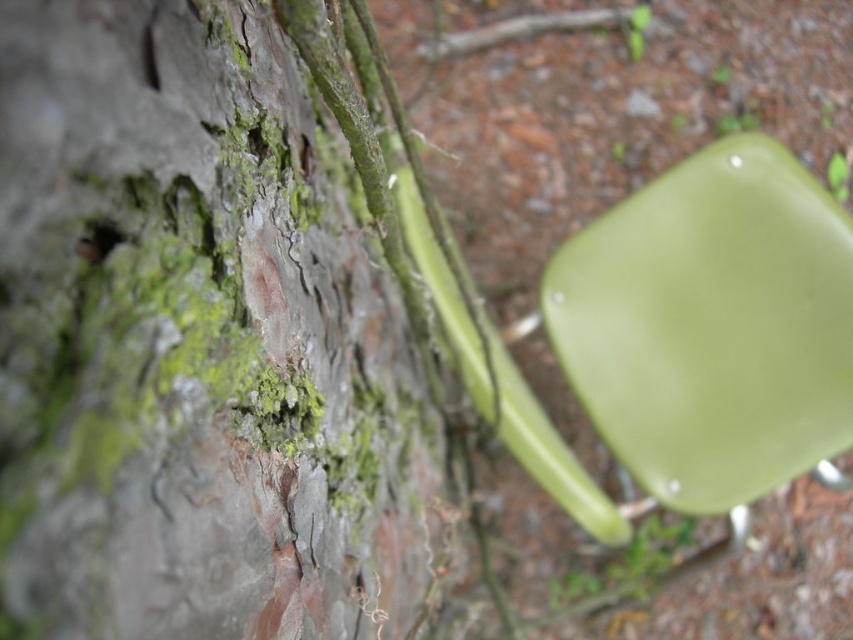
Can you confirm if green matte tree trunk at center is positioned above matte green plastic chair at upper right?

No, green matte tree trunk at center is not above matte green plastic chair at upper right.

Consider the image. Between green matte tree trunk at center and matte green plastic chair at upper right, which one is positioned higher?

Positioned higher is matte green plastic chair at upper right.

Where is `green matte tree trunk at center`? The image size is (853, 640). green matte tree trunk at center is located at coordinates (195, 342).